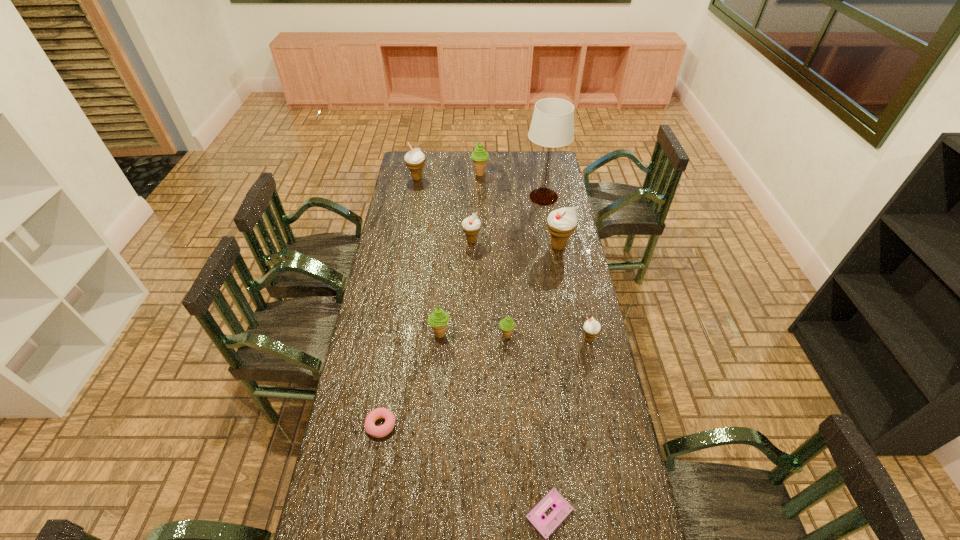
Image resolution: width=960 pixels, height=540 pixels. Identify the location of free space between the second biggest green icecream and the pink doughnut. (411, 380).

Where is `vacant region between the pink doughnut and the second green icecream from right to left`? The height and width of the screenshot is (540, 960). vacant region between the pink doughnut and the second green icecream from right to left is located at coordinates (430, 300).

Locate an element on the screen. This screenshot has width=960, height=540. vacant point located between the third white icecream from right to left and the leftmost icecream is located at coordinates (444, 210).

The width and height of the screenshot is (960, 540). Identify the location of vacant area between the eighth nearest object and the third smallest white icecream. (x=480, y=188).

Select which object appears as the eighth closest to the table lamp. Please provide its 2D coordinates. Your answer should be formatted as a tuple, i.e. [(x, y)], where the tuple contains the x and y coordinates of a point satisfying the conditions above.

[(375, 431)]

In order to click on object that is the sixth closest to the videotape in this screenshot , I will do `click(471, 226)`.

You are a GUI agent. You are given a task and a screenshot of the screen. Output one action in this format:
    pyautogui.click(x=<x>, y=<y>)
    Task: Click on the icecream that is the fifth closest to the eighth nearest object
    This screenshot has height=540, width=960.
    Given the screenshot: What is the action you would take?
    pyautogui.click(x=507, y=324)

Point out which icecream is positioned as the second nearest to the second white icecream from left to right. Please provide its 2D coordinates. Your answer should be formatted as a tuple, i.e. [(x, y)], where the tuple contains the x and y coordinates of a point satisfying the conditions above.

[(438, 320)]

Identify which white icecream is the third closest to the third object from left to right. Please provide its 2D coordinates. Your answer should be formatted as a tuple, i.e. [(x, y)], where the tuple contains the x and y coordinates of a point satisfying the conditions above.

[(561, 223)]

Identify which white icecream is the third nearest to the third icecream from right to left. Please provide its 2D coordinates. Your answer should be formatted as a tuple, i.e. [(x, y)], where the tuple contains the x and y coordinates of a point satisfying the conditions above.

[(471, 226)]